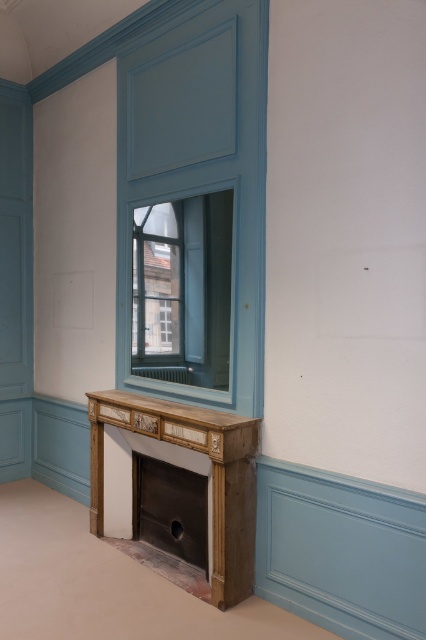
Consider the image. Is wooden fireplace at lower center above metallic silver fireplace at lower center?

Correct, wooden fireplace at lower center is located above metallic silver fireplace at lower center.

Is the position of wooden fireplace at lower center less distant than that of metallic silver fireplace at lower center?

That is True.

Is point (241, 582) less distant than point (166, 497)?

Yes, point (241, 582) is in front of point (166, 497).

Where is `wooden fireplace at lower center`? This screenshot has height=640, width=426. wooden fireplace at lower center is located at coordinates (210, 474).

Does matte glass window at center lie in front of metallic silver fireplace at lower center?

Yes, matte glass window at center is closer to the viewer.

Does matte glass window at center appear on the right side of metallic silver fireplace at lower center?

Correct, you'll find matte glass window at center to the right of metallic silver fireplace at lower center.

Image resolution: width=426 pixels, height=640 pixels. What do you see at coordinates (183, 289) in the screenshot?
I see `matte glass window at center` at bounding box center [183, 289].

Find the location of `matte glass window at center`. matte glass window at center is located at coordinates (183, 289).

Which is more to the right, wooden fireplace at lower center or wooden mantel at center?

wooden fireplace at lower center

Which of these two, wooden fireplace at lower center or wooden mantel at center, stands taller?

wooden fireplace at lower center is taller.

Does point (111, 401) come closer to viewer compared to point (193, 406)?

No.

Where is `wooden fireplace at lower center`? This screenshot has height=640, width=426. wooden fireplace at lower center is located at coordinates (210, 474).